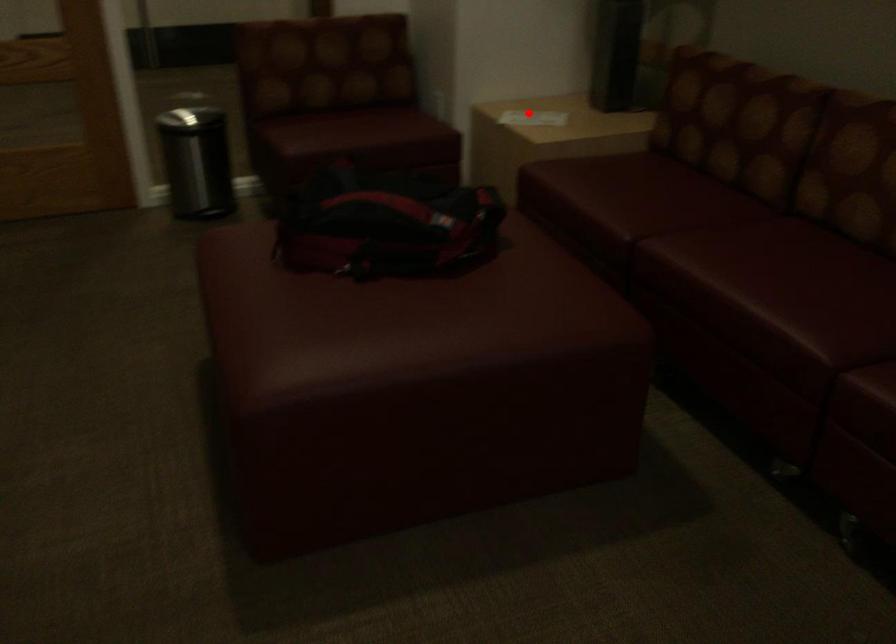
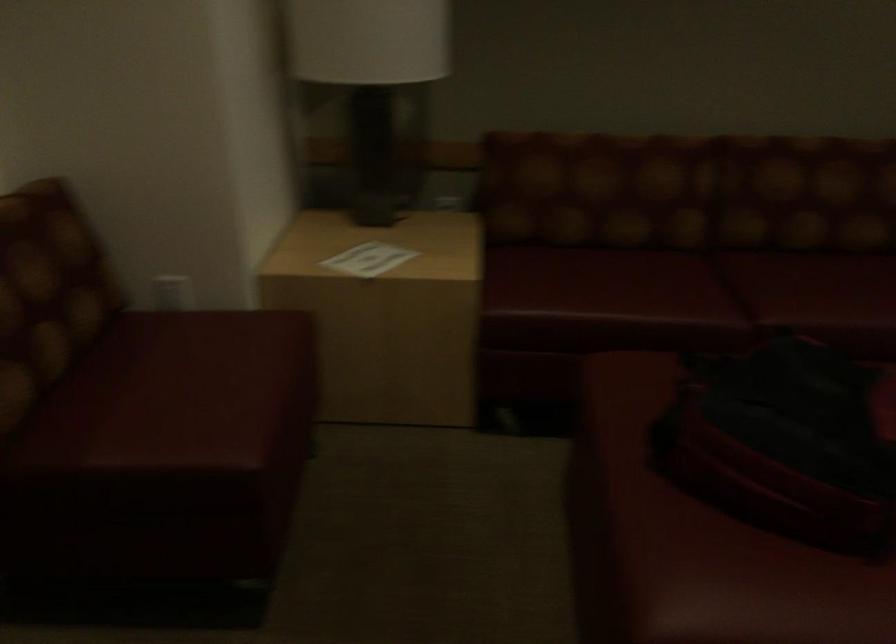
Question: I am providing you with two images of the same scene from different viewpoints. Given a red point in image1, look at the same physical point in image2. Is it:

Choices:
 (A) Closer to the viewpoint
 (B) Farther from the viewpoint

Answer: (A)